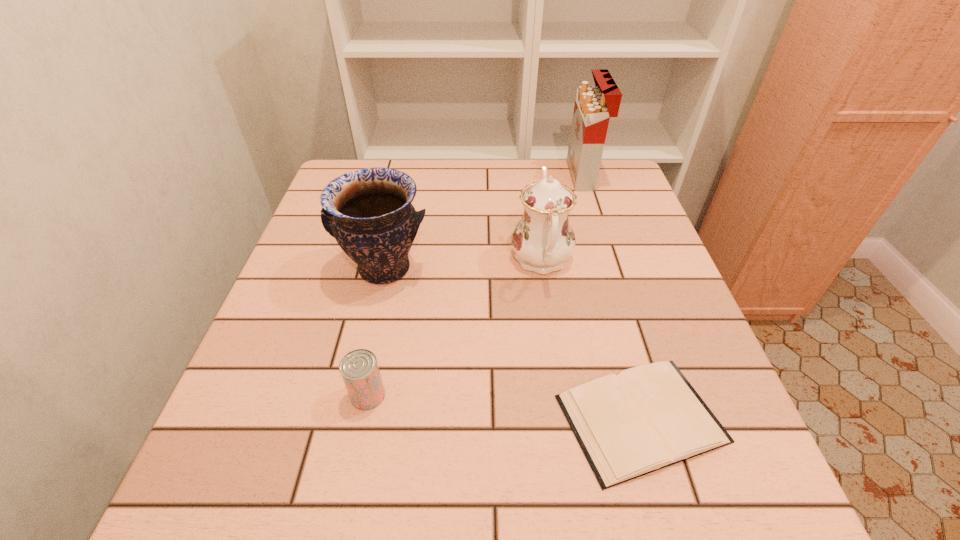
Image resolution: width=960 pixels, height=540 pixels. I want to click on free spot between the farthest object and the second shortest object, so click(x=475, y=285).

Where is `unoccupied area between the second shortest object and the hardback book`? This screenshot has height=540, width=960. unoccupied area between the second shortest object and the hardback book is located at coordinates (504, 407).

The width and height of the screenshot is (960, 540). What are the coordinates of `vacant space that's between the pottery and the beer can` in the screenshot? It's located at (376, 332).

Where is `free space that is in between the hardback book and the chinaware`? free space that is in between the hardback book and the chinaware is located at coordinates (591, 339).

I want to click on object that stands as the third closest to the cigarette case, so click(649, 417).

Identify the location of object that can be found as the fourth closest to the beer can. The height and width of the screenshot is (540, 960). (594, 105).

Locate an element on the screen. The image size is (960, 540). free space that satisfies the following two spatial constraints: 1. on the front handle of the pottery; 2. on the right side of the shortest object is located at coordinates (350, 418).

Find the location of a particular element. The height and width of the screenshot is (540, 960). free point that satisfies the following two spatial constraints: 1. on the front handle of the pottery; 2. on the right side of the shortest object is located at coordinates (350, 418).

You are a GUI agent. You are given a task and a screenshot of the screen. Output one action in this format:
    pyautogui.click(x=<x>, y=<y>)
    Task: Click on the vacant point that satisfies the following two spatial constraints: 1. on the front handle of the pottery; 2. on the left side of the shortest object
    
    Given the screenshot: What is the action you would take?
    pyautogui.click(x=350, y=418)